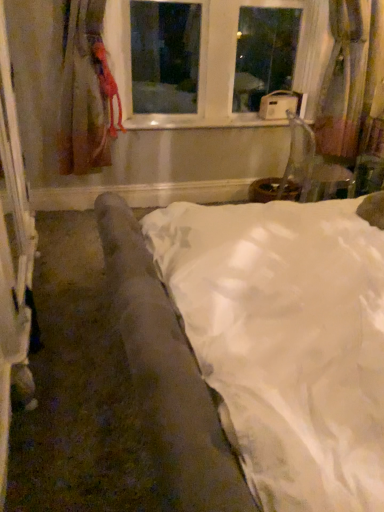
Question: Is velvet brown armchair at lower right wider or thinner than white satin bed at center?

Choices:
 (A) thin
 (B) wide

Answer: (A)

Question: From a real-world perspective, is velvet brown armchair at lower right physically located above or below white satin bed at center?

Choices:
 (A) below
 (B) above

Answer: (B)

Question: Which of these objects is positioned farthest from the velvet-like pink curtain at right, which ranks as the second curtain in left-to-right order?

Choices:
 (A) white glossy window sill at center
 (B) white plastic window at upper center
 (C) matte red curtain at left, the 2th curtain from the right
 (D) velvet brown armchair at lower right
 (E) white satin bed at center

Answer: (E)

Question: Which object is the closest to the white satin bed at center?

Choices:
 (A) white glossy window sill at center
 (B) white plastic window at upper center
 (C) velvet brown armchair at lower right
 (D) matte red curtain at left, acting as the 1th curtain starting from the left
 (E) velvet-like pink curtain at right, which ranks as the second curtain in left-to-right order

Answer: (D)